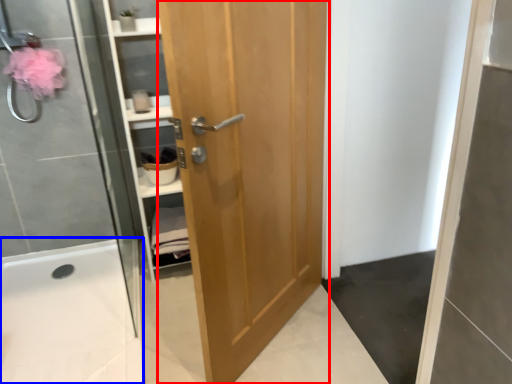
Question: Which point is closer to the camera, door (highlighted by a red box) or bath (highlighted by a blue box)?

Choices:
 (A) door
 (B) bath

Answer: (A)